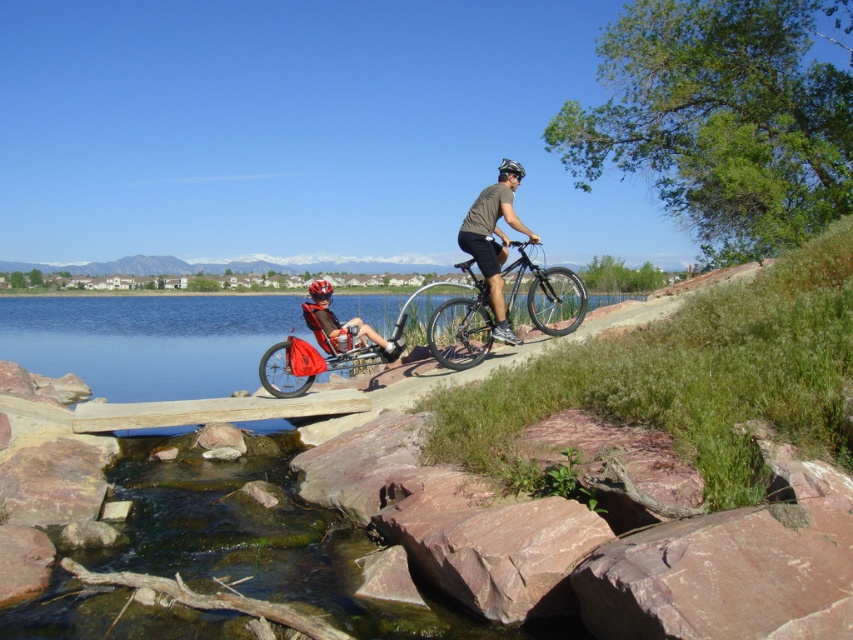
Question: Which object appears farthest from the camera in this image?

Choices:
 (A) matte red bicycle at center
 (B) shiny black bike at center
 (C) matte black bicycle at center
 (D) red matte bicycle helmet at center

Answer: (D)

Question: Does shiny black bike at center appear on the right side of matte black bicycle at center?

Choices:
 (A) no
 (B) yes

Answer: (B)

Question: Does shiny black bike at center appear over matte red bicycle at center?

Choices:
 (A) yes
 (B) no

Answer: (A)

Question: Which point is farther from the camera taking this photo?

Choices:
 (A) (498, 170)
 (B) (332, 352)

Answer: (A)

Question: Is red matte bicycle helmet at center positioned behind black matte bicycle helmet at upper center?

Choices:
 (A) no
 (B) yes

Answer: (B)

Question: Which of the following is the farthest from the observer?

Choices:
 (A) black matte bicycle helmet at upper center
 (B) red matte bicycle helmet at center

Answer: (B)